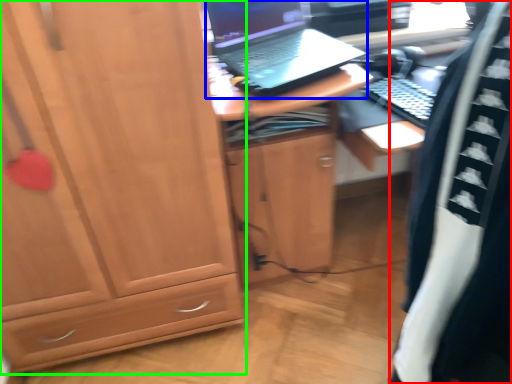
Question: Which object is positioned closest to clothing (highlighted by a red box)? Select from laptop (highlighted by a blue box) and cabinetry (highlighted by a green box).

Choices:
 (A) laptop
 (B) cabinetry

Answer: (B)